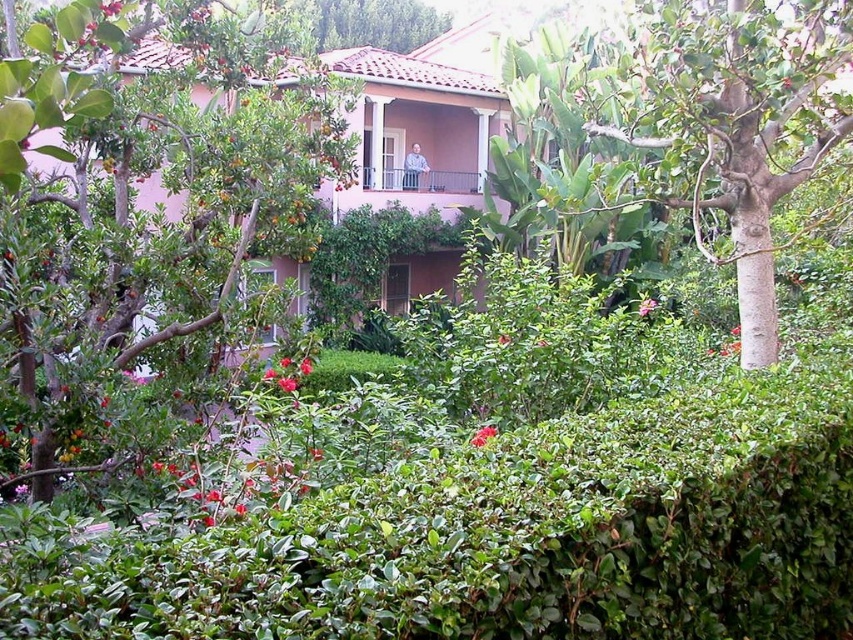
Question: Among these points, which one is farthest from the camera?

Choices:
 (A) (293, 384)
 (B) (270, 371)
 (C) (305, 364)

Answer: (C)

Question: Does green leafy tree at center appear under green matte flower at center?

Choices:
 (A) no
 (B) yes

Answer: (A)

Question: Which point appears farthest from the camera in this image?

Choices:
 (A) (281, 360)
 (B) (270, 369)

Answer: (A)

Question: Is the position of green matte flower at center more distant than that of bright red petals at center?

Choices:
 (A) no
 (B) yes

Answer: (B)

Question: Can you confirm if green leafy tree at upper center is wider than green matte flower at center?

Choices:
 (A) yes
 (B) no

Answer: (A)

Question: Estimate the real-world distances between objects in this image. Which object is farther from the white matte flower at center?

Choices:
 (A) vivid red petals at center
 (B) vivid pink petals at center
 (C) red matte flower at center

Answer: (C)